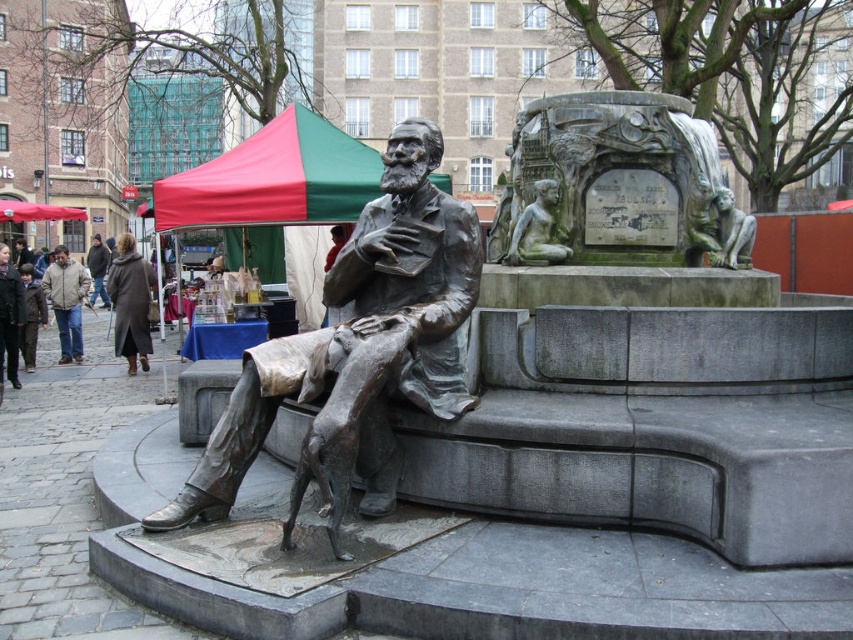
Is brown leather jacket at left wider than dark brown leather coat at center?

No, brown leather jacket at left is not wider than dark brown leather coat at center.

Is brown leather jacket at left closer to camera compared to dark brown leather coat at center?

That is True.

Is point (65, 289) farther from camera compared to point (96, 291)?

No.

The image size is (853, 640). What are the coordinates of `brown leather jacket at left` in the screenshot? It's located at (67, 301).

Can you confirm if green patina stone monument at upper right is positioned to the right of brown wool coat at center?

Correct, you'll find green patina stone monument at upper right to the right of brown wool coat at center.

Locate an element on the screen. This screenshot has width=853, height=640. green patina stone monument at upper right is located at coordinates (616, 186).

Is point (596, 128) behind point (141, 289)?

That is False.

What are the coordinates of `green patina stone monument at upper right` in the screenshot? It's located at (616, 186).

Does bronze statue at center appear over red fabric canopy at upper center?

No, bronze statue at center is not above red fabric canopy at upper center.

This screenshot has height=640, width=853. I want to click on bronze statue at center, so click(x=357, y=349).